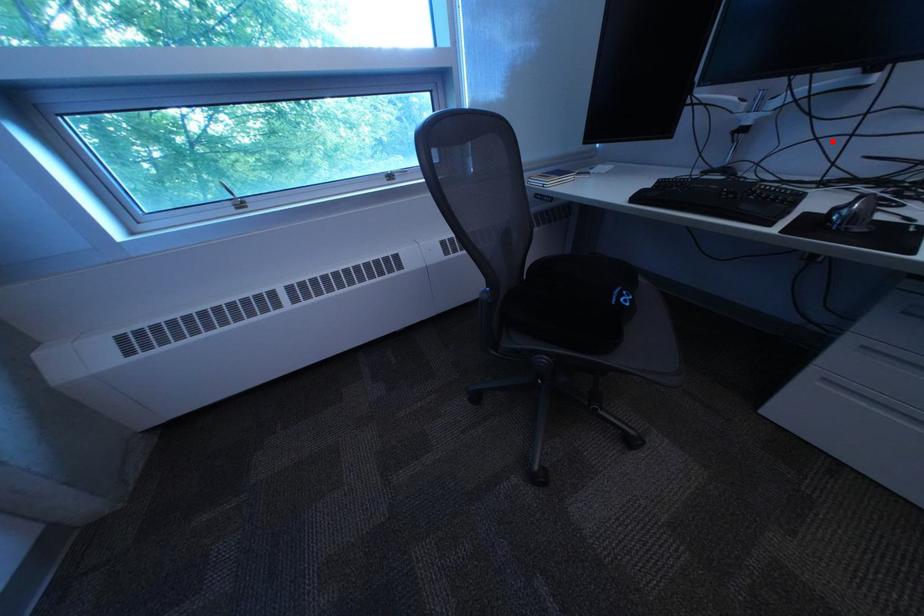
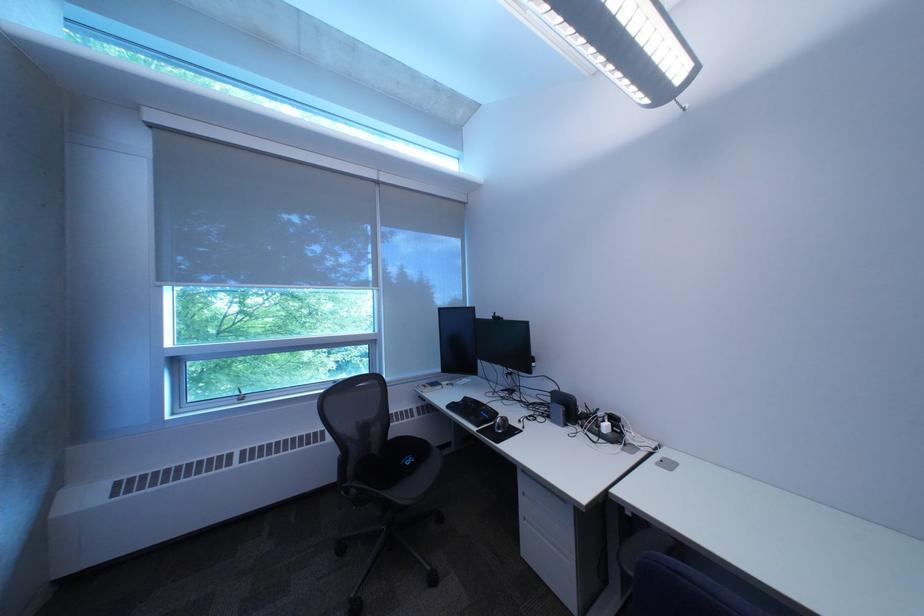
Locate, in the second image, the point that corresponds to the highlighted location in the first image.

(532, 387)